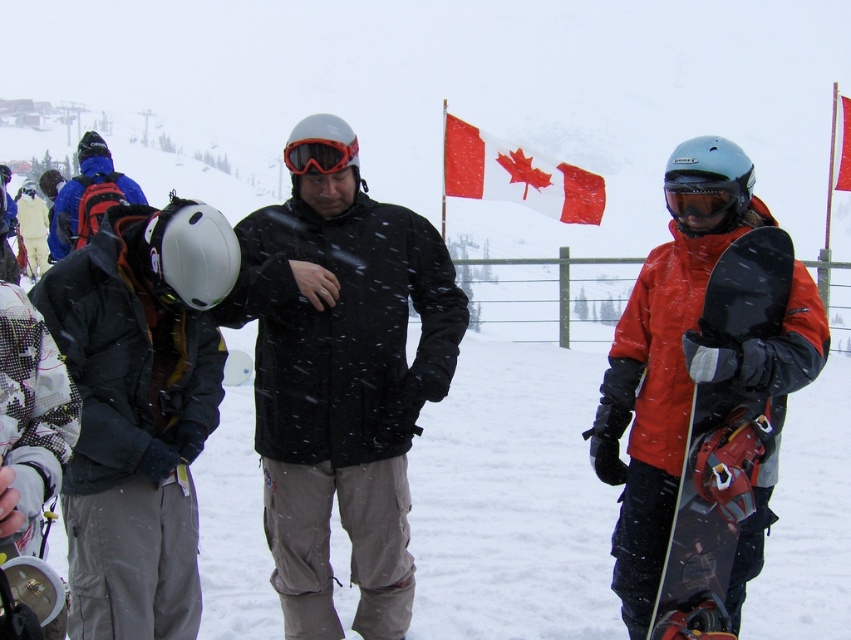
Question: Which object appears closest to the camera in this image?

Choices:
 (A) black matte snowboard at right
 (B) matte black jacket at center
 (C) matte black snowboard at right

Answer: (B)

Question: Which object appears farthest from the camera in this image?

Choices:
 (A) matte black snowboard at right
 (B) black matte snowboard at right

Answer: (A)

Question: Can you confirm if matte black jacket at center is thinner than red fabric flag at center?

Choices:
 (A) yes
 (B) no

Answer: (A)

Question: Is matte black jacket at center to the left of black matte snowboard at right from the viewer's perspective?

Choices:
 (A) yes
 (B) no

Answer: (A)

Question: Can you confirm if matte black helmet at left is positioned to the left of red fabric flag at center?

Choices:
 (A) no
 (B) yes

Answer: (B)

Question: Based on their relative distances, which object is nearer to the orange matte goggles at center?

Choices:
 (A) red fabric flag at center
 (B) matte black helmet at left
 (C) matte black snowboard at right

Answer: (B)